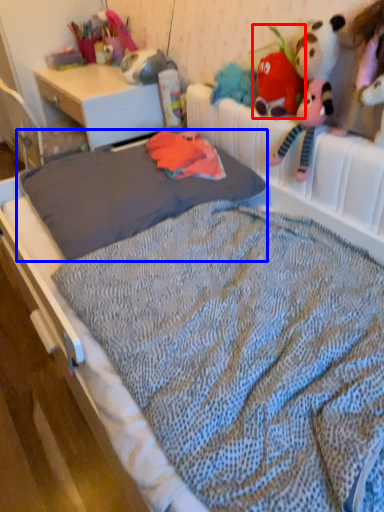
Question: Which object appears closest to the camera in this image, toy (highlighted by a red box) or mattress (highlighted by a blue box)?

Choices:
 (A) toy
 (B) mattress

Answer: (B)